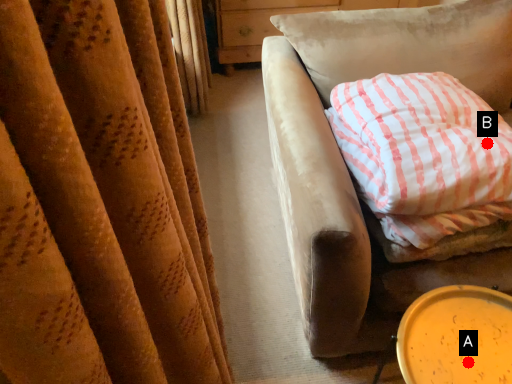
Question: Two points are circled on the image, labeled by A and B beside each circle. Which of the following is the farthest from the observer?

Choices:
 (A) A is further
 (B) B is further

Answer: (B)